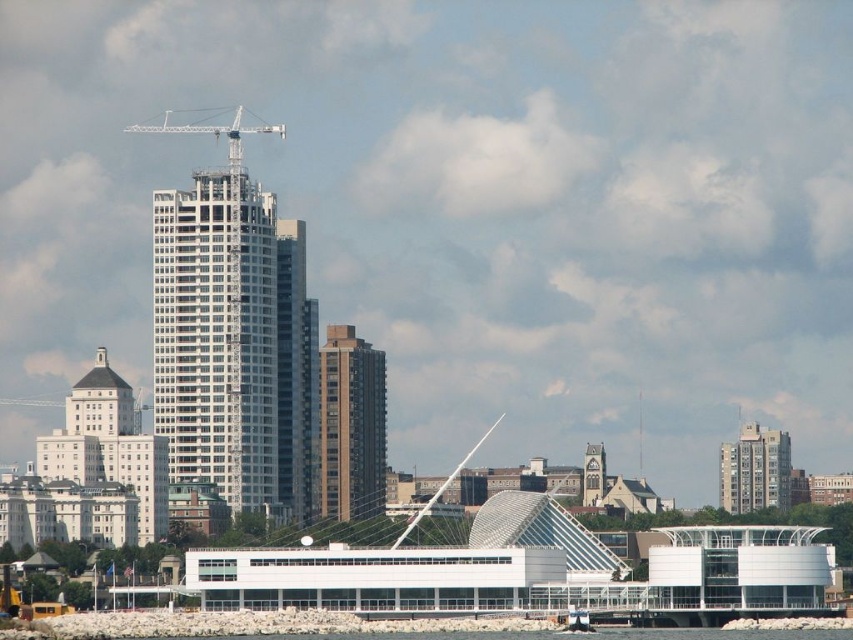
You are standing at the point closest to the camera in the image. Which point, point (341, 364) or point (167, 124), are you currently at?

You are at point (341, 364) because it is in front of point (167, 124), so it is closer to the camera.

You are a city planner assessing the urban skyline. Given the partly cloudy sky in the scene, which object, the gray concrete building at right or the white metallic crane at upper center, would cast a longer shadow? Please explain your reasoning based on their positions and heights.

The gray concrete building at right is much taller than the white metallic crane at upper center. Since taller objects generally cast longer shadows, the gray concrete building at right would cast a longer shadow.